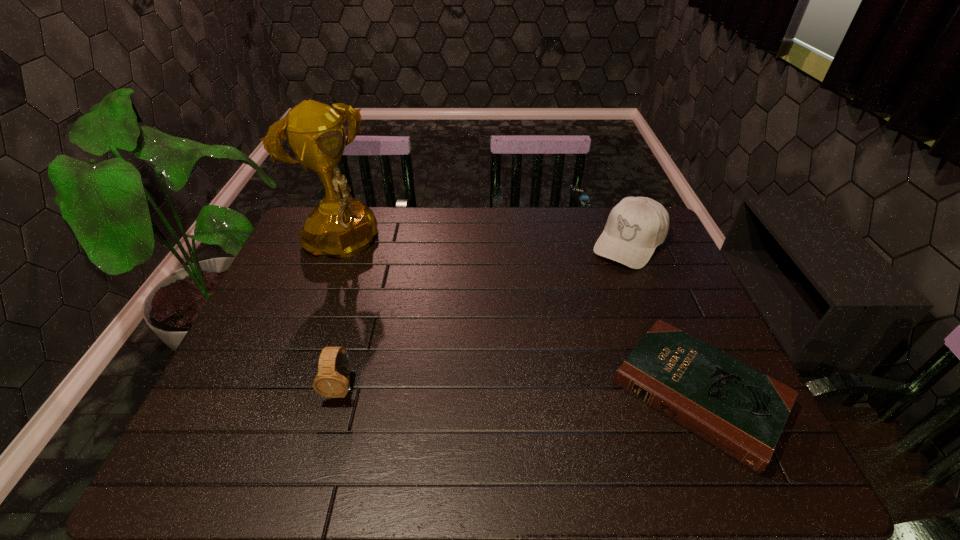
The width and height of the screenshot is (960, 540). I want to click on free spot on the desktop that is between the watch and the Bible and is positioned on the front-facing side of the baseball cap, so click(x=514, y=390).

Where is `free space on the desktop that is between the watch and the shortest object and is positioned on the front side of the tallest object`? The image size is (960, 540). free space on the desktop that is between the watch and the shortest object and is positioned on the front side of the tallest object is located at coordinates (501, 390).